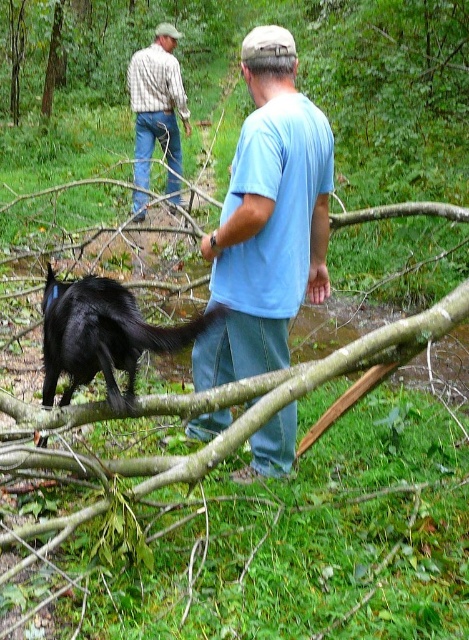
From the picture: Is blue cotton shirt at center thinner than plaid shirt at upper left?

No.

Who is more distant from viewer, (293,193) or (144,122)?

The point (144,122) is more distant.

Identify the location of blue cotton shirt at center. tap(267, 220).

Is the position of blue cotton shirt at center less distant than that of shiny black dog at lower left?

No, blue cotton shirt at center is further to the viewer.

Can you confirm if blue cotton shirt at center is taller than shiny black dog at lower left?

Correct, blue cotton shirt at center is much taller as shiny black dog at lower left.

The height and width of the screenshot is (640, 469). I want to click on blue cotton shirt at center, so click(x=267, y=220).

Find the location of `blue cotton shirt at center`. blue cotton shirt at center is located at coordinates (267, 220).

Is point (105, 380) farther from viewer compared to point (140, 67)?

No, it is not.

Between shiny black dog at lower left and plaid shirt at upper left, which one has more height?

plaid shirt at upper left is taller.

What are the coordinates of `shiny black dog at lower left` in the screenshot? It's located at (103, 336).